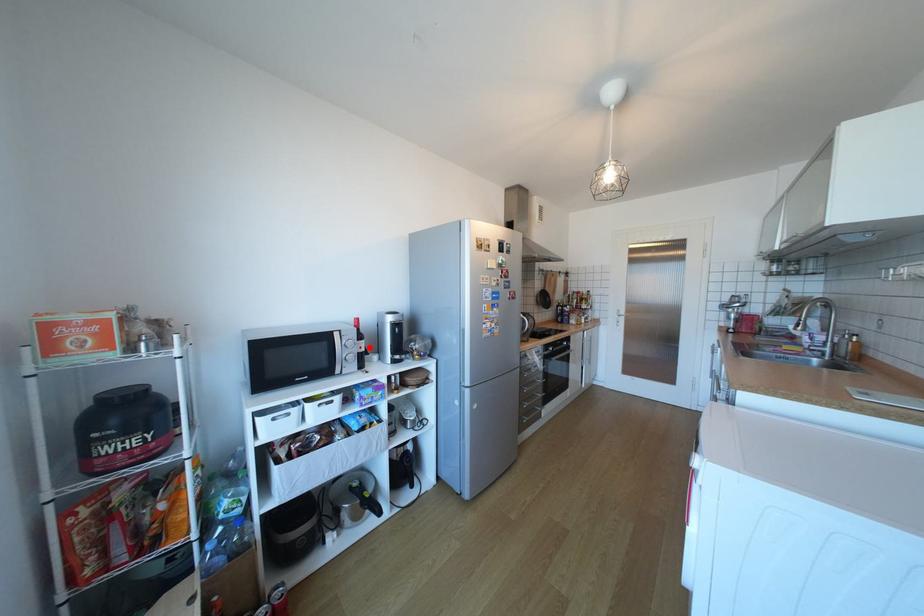
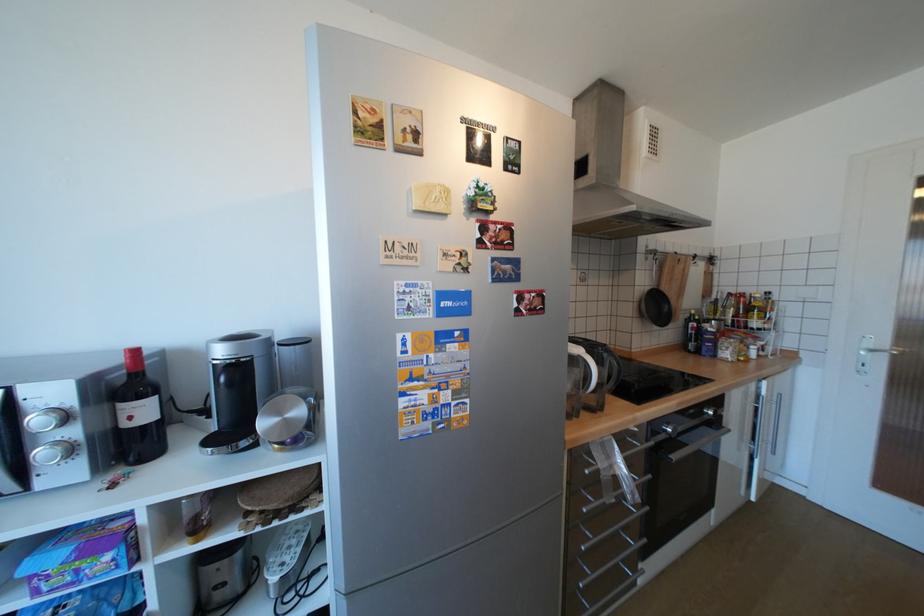
In the second image, find the point that corresponds to the highlighted location in the first image.

(140, 418)